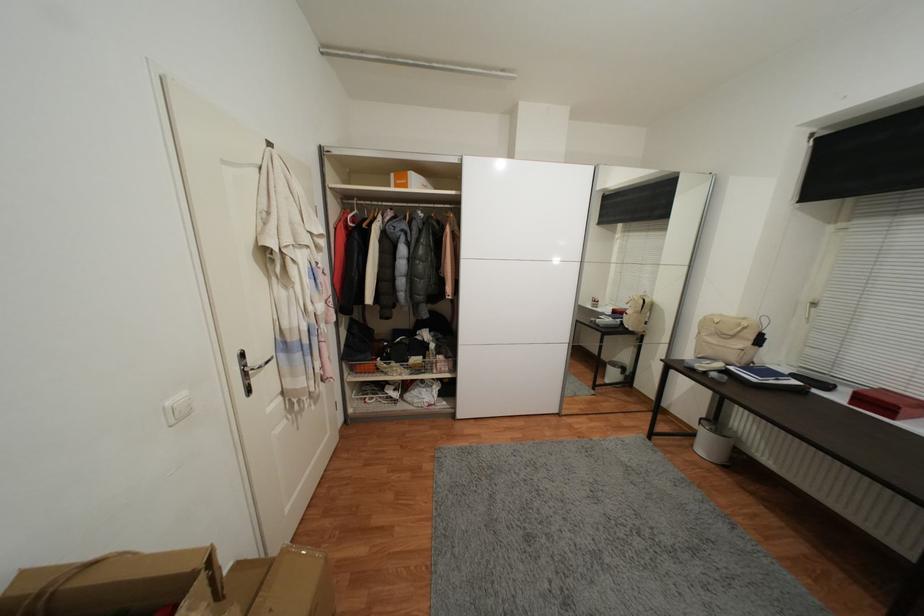
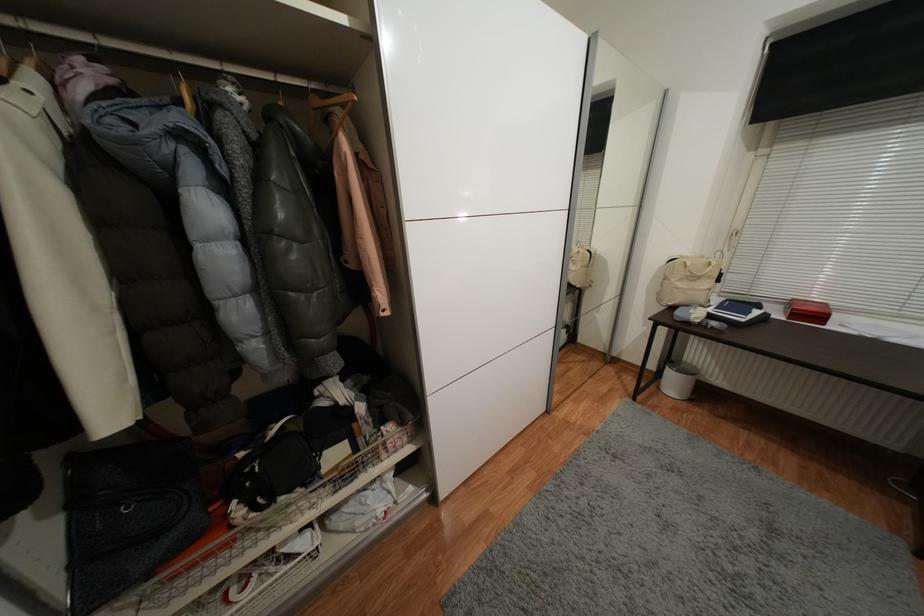
Where in the second image is the point corresponding to (748,321) from the first image?

(707, 257)